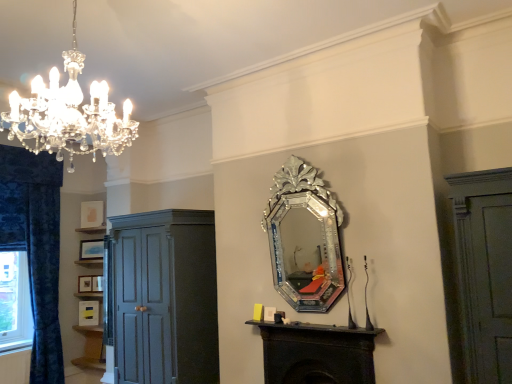
Question: From the image's perspective, does matte white picture frame at center, the 3th picture frame viewed from the top, appear lower than blue textured curtain at left?

Choices:
 (A) no
 (B) yes

Answer: (B)

Question: Can you confirm if matte white picture frame at center, the 3th picture frame viewed from the top, is wider than blue textured curtain at left?

Choices:
 (A) no
 (B) yes

Answer: (A)

Question: Does matte white picture frame at center, the 3th picture frame viewed from the top, have a greater height compared to blue textured curtain at left?

Choices:
 (A) no
 (B) yes

Answer: (A)

Question: Is blue textured curtain at left completely or partially inside matte white picture frame at center, positioned as the third picture frame in bottom-to-top order?

Choices:
 (A) yes
 (B) no

Answer: (B)

Question: From a real-world perspective, is matte white picture frame at center, the 3th picture frame viewed from the top, on blue textured curtain at left?

Choices:
 (A) no
 (B) yes

Answer: (A)

Question: Is matte white picture frame at center, the 3th picture frame viewed from the top, with blue textured curtain at left?

Choices:
 (A) no
 (B) yes

Answer: (A)

Question: Is blue velvet curtain at left shorter than matte yellow picture frame at lower left, the 1th picture frame positioned from the bottom?

Choices:
 (A) yes
 (B) no

Answer: (B)

Question: Can matte yellow picture frame at lower left, which is the 5th picture frame from top to bottom, be found inside blue velvet curtain at left?

Choices:
 (A) yes
 (B) no

Answer: (B)

Question: From the image's perspective, is blue velvet curtain at left located above matte yellow picture frame at lower left, which is the 5th picture frame from top to bottom?

Choices:
 (A) yes
 (B) no

Answer: (A)

Question: Can you confirm if blue velvet curtain at left is smaller than matte yellow picture frame at lower left, which is the 5th picture frame from top to bottom?

Choices:
 (A) yes
 (B) no

Answer: (B)

Question: Is blue velvet curtain at left facing towards matte yellow picture frame at lower left, the 1th picture frame positioned from the bottom?

Choices:
 (A) yes
 (B) no

Answer: (B)

Question: Are blue velvet curtain at left and matte yellow picture frame at lower left, which is the 5th picture frame from top to bottom, located far from each other?

Choices:
 (A) no
 (B) yes

Answer: (B)

Question: Does matte dark gray cupboard at left have a greater height compared to matte gold picture frame at left, marked as the 2th picture frame in a bottom-to-top arrangement?

Choices:
 (A) yes
 (B) no

Answer: (A)